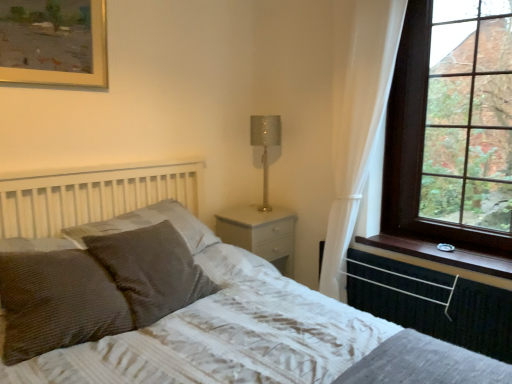
I want to click on blank space above brown wood window sill at right (from a real-world perspective), so click(x=454, y=244).